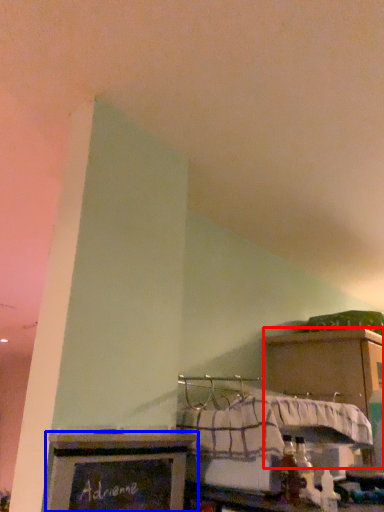
Question: Which object is closer to the camera taking this photo, cabinetry (highlighted by a red box) or furniture (highlighted by a blue box)?

Choices:
 (A) cabinetry
 (B) furniture

Answer: (B)